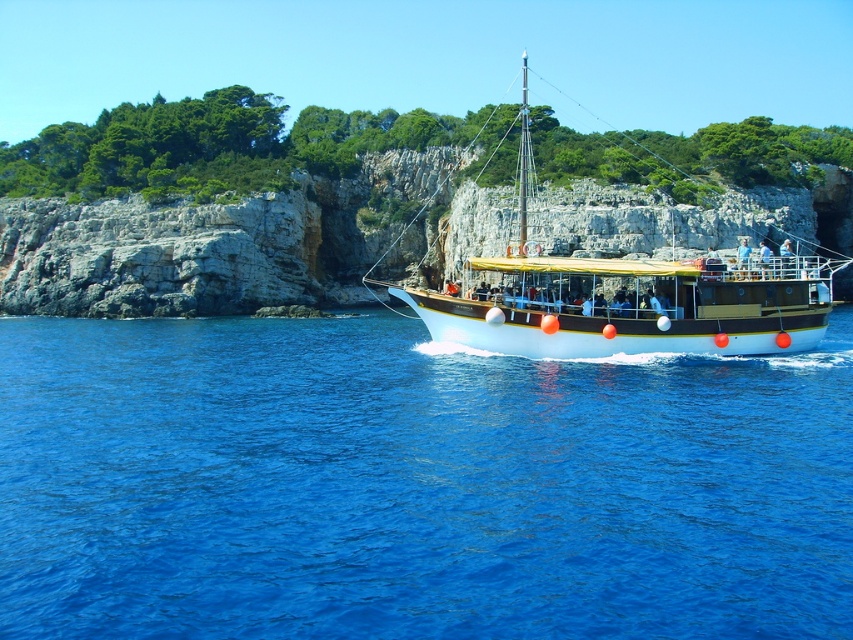
Question: Which of the following is the closest to the observer?

Choices:
 (A) (453, 451)
 (B) (601, 275)

Answer: (A)

Question: Does blue liquid water at center have a smaller size compared to white wooden boat at center?

Choices:
 (A) yes
 (B) no

Answer: (A)

Question: Is blue liquid water at center bigger than white wooden boat at center?

Choices:
 (A) yes
 (B) no

Answer: (B)

Question: Is blue liquid water at center smaller than white wooden boat at center?

Choices:
 (A) no
 (B) yes

Answer: (B)